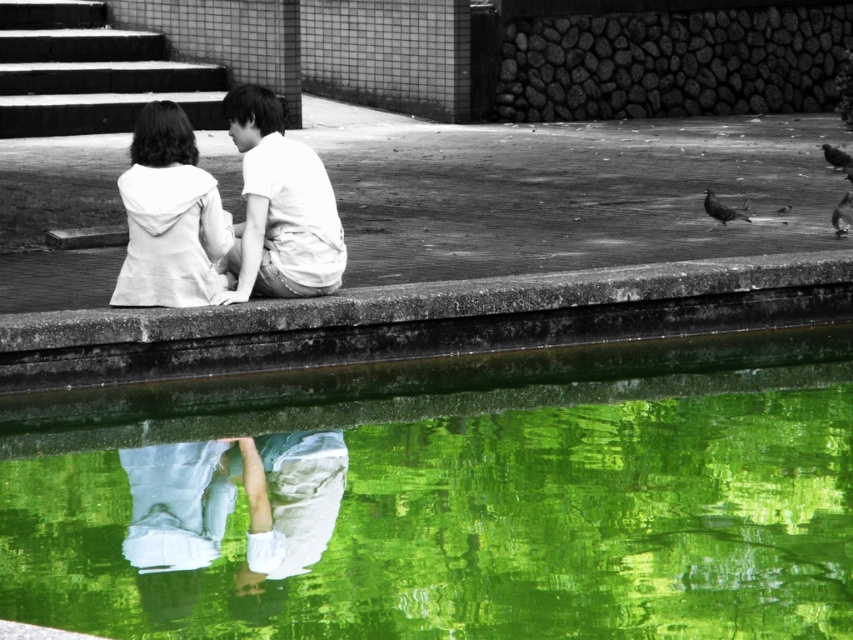
You are standing in front of the black and white photograph with selective color. You notice two points marked in the image. Which point, point (169,499) or point (206,212), is closer to you?

Point (169,499) is closer to the camera than point (206,212).

You are a photographer standing in the scene described. You want to capture a shot where the green reflective water at center clearly shows the reflection of the white matte hoodie at upper left. Based on their positions, is this possible?

Yes, because the green reflective water at center is in front of the white matte hoodie at upper left, the reflection of the hoodie will be visible in the water.